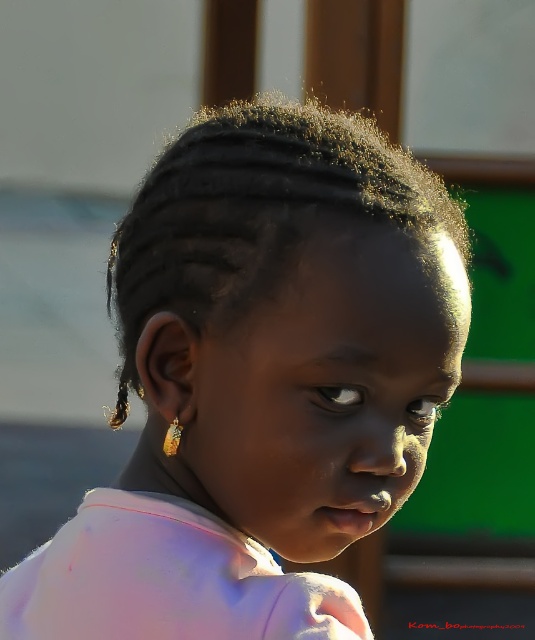
Which is behind, point (202, 148) or point (118, 403)?

The point (118, 403) is more distant.

Who is positioned more to the left, dark brown textured hair at center or black glossy hair at left?

From the viewer's perspective, black glossy hair at left appears more on the left side.

Is point (263, 176) closer to viewer compared to point (107, 280)?

Yes, it is in front of point (107, 280).

Locate an element on the screen. Image resolution: width=535 pixels, height=640 pixels. dark brown textured hair at center is located at coordinates tap(262, 209).